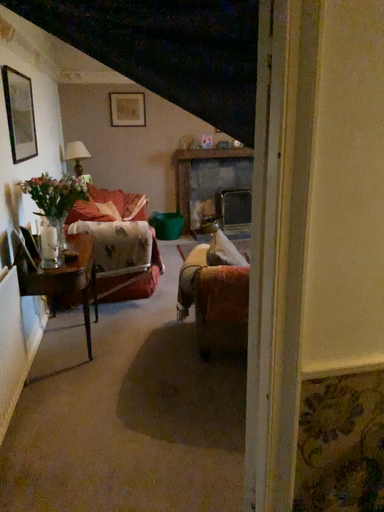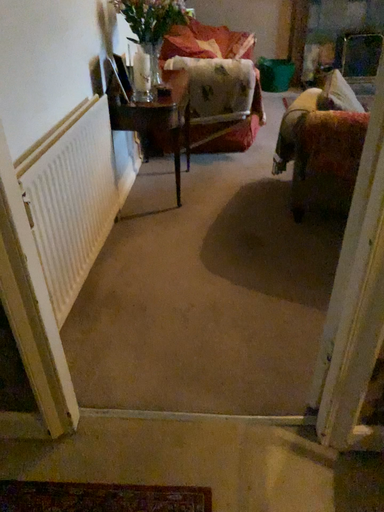
Question: How did the camera likely rotate when shooting the video?

Choices:
 (A) rotated right
 (B) rotated left

Answer: (B)